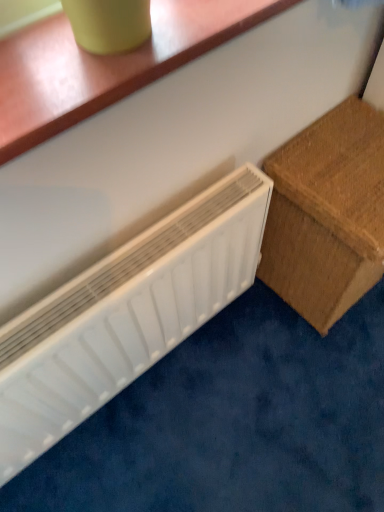
Question: Should I look upward or downward to see white plastic radiator at lower left?

Choices:
 (A) up
 (B) down

Answer: (B)

Question: Is white plastic radiator at lower left surrounded by brown woven box at right?

Choices:
 (A) yes
 (B) no

Answer: (B)

Question: Is the position of brown woven box at right less distant than that of white plastic radiator at lower left?

Choices:
 (A) yes
 (B) no

Answer: (B)

Question: From a real-world perspective, is brown woven box at right over white plastic radiator at lower left?

Choices:
 (A) yes
 (B) no

Answer: (B)

Question: From a real-world perspective, does brown woven box at right sit lower than white plastic radiator at lower left?

Choices:
 (A) yes
 (B) no

Answer: (A)

Question: Considering the relative sizes of brown woven box at right and white plastic radiator at lower left in the image provided, is brown woven box at right thinner than white plastic radiator at lower left?

Choices:
 (A) yes
 (B) no

Answer: (B)

Question: Could you tell me if brown woven box at right is facing white plastic radiator at lower left?

Choices:
 (A) no
 (B) yes

Answer: (A)

Question: Is white plastic radiator at lower left directly adjacent to brown woven box at right?

Choices:
 (A) yes
 (B) no

Answer: (B)

Question: Is white plastic radiator at lower left oriented away from brown woven box at right?

Choices:
 (A) yes
 (B) no

Answer: (B)

Question: Is brown woven box at right surrounded by white plastic radiator at lower left?

Choices:
 (A) yes
 (B) no

Answer: (B)

Question: Can you confirm if white plastic radiator at lower left is wider than brown woven box at right?

Choices:
 (A) yes
 (B) no

Answer: (B)

Question: Is white plastic radiator at lower left to the right of brown woven box at right from the viewer's perspective?

Choices:
 (A) no
 (B) yes

Answer: (A)

Question: From the image's perspective, is white plastic radiator at lower left above brown woven box at right?

Choices:
 (A) yes
 (B) no

Answer: (B)

Question: Do you think brown woven box at right is within white plastic radiator at lower left, or outside of it?

Choices:
 (A) outside
 (B) inside

Answer: (A)